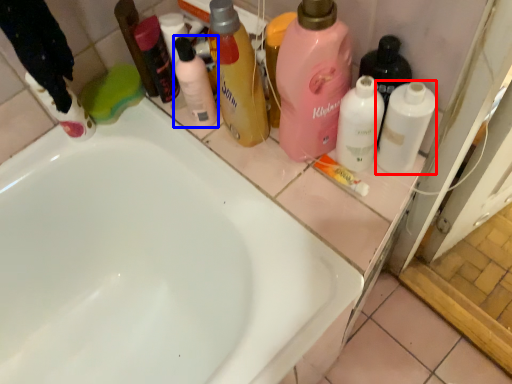
Question: Which of the following is the closest to the observer, cleaning product (highlighted by a red box) or cleaning product (highlighted by a blue box)?

Choices:
 (A) cleaning product
 (B) cleaning product

Answer: (A)